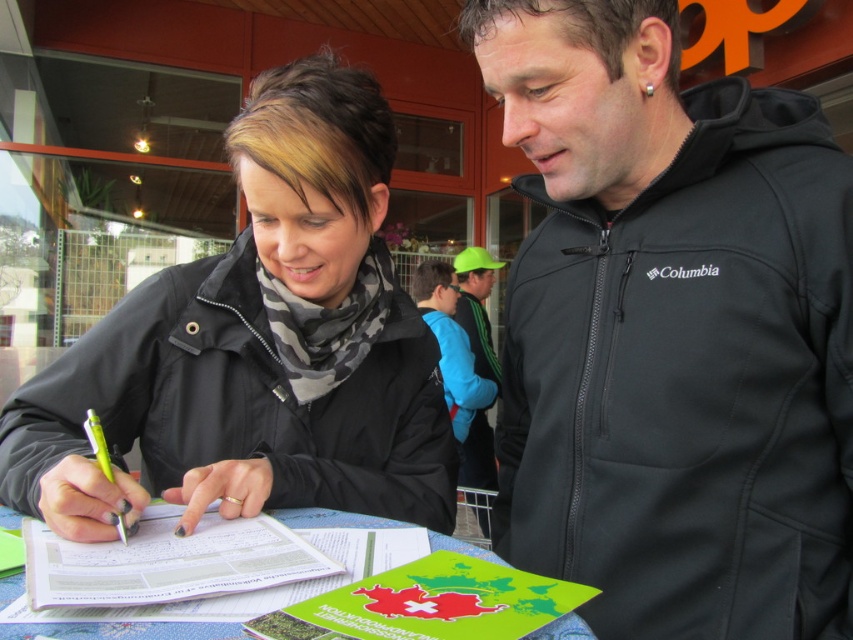
Question: Which point is farther to the camera?

Choices:
 (A) (712, 264)
 (B) (120, 524)
 (C) (479, 300)

Answer: (C)

Question: Which of these objects is positioned closest to the black matte jacket at center?

Choices:
 (A) black softshell jacket at center
 (B) translucent yellow pen at lower left
 (C) neon green fabric at center
 (D) paper with printed text at center

Answer: (D)

Question: Can you confirm if paper with printed text at center is wider than neon green fabric at center?

Choices:
 (A) no
 (B) yes

Answer: (B)

Question: Does paper with printed text at center appear on the right side of translucent yellow pen at lower left?

Choices:
 (A) no
 (B) yes

Answer: (B)

Question: Is the position of paper with printed text at center less distant than that of translucent yellow pen at lower left?

Choices:
 (A) no
 (B) yes

Answer: (B)

Question: Which of the following is the farthest from the observer?

Choices:
 (A) black softshell jacket at center
 (B) white paper at center

Answer: (A)